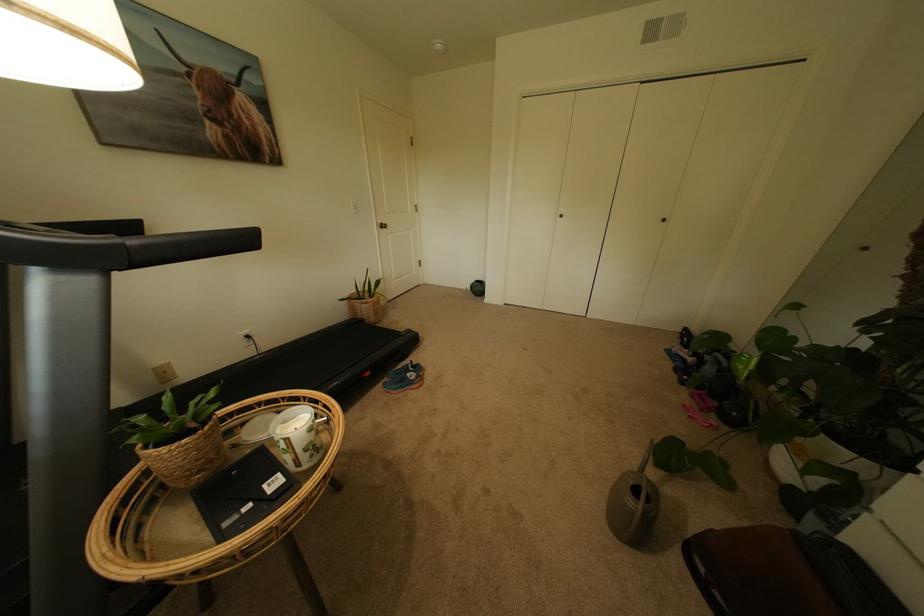
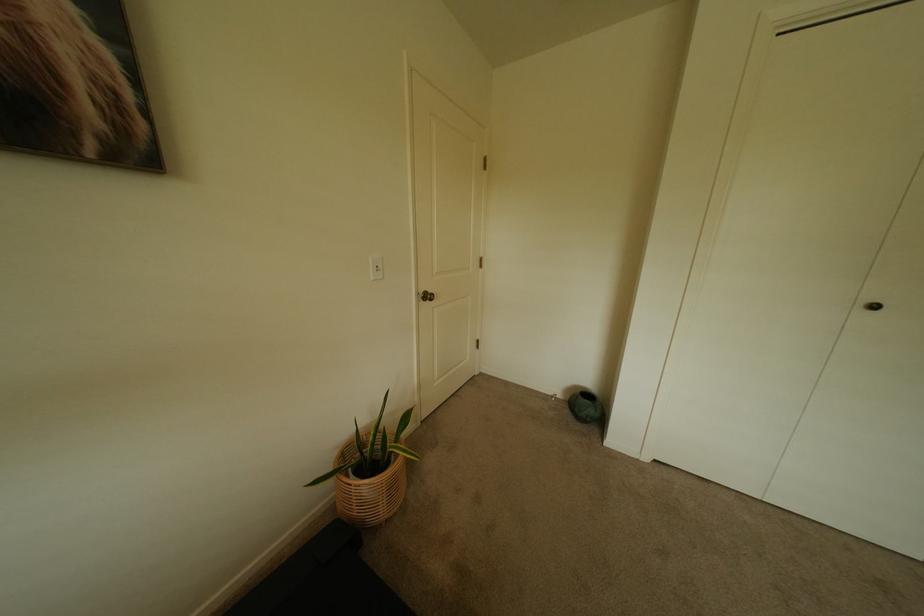
Question: Which direction would the cameraman need to move to produce the second image? Reply with the corresponding letter.

Choices:
 (A) Left
 (B) Right
 (C) Forward
 (D) Backward

Answer: (C)